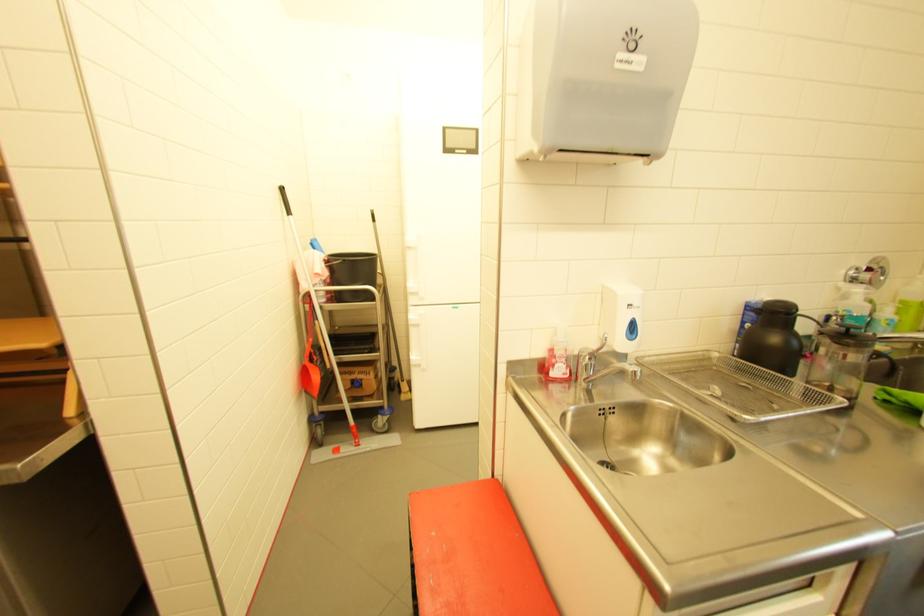
Where is `black thermos`? The height and width of the screenshot is (616, 924). black thermos is located at coordinates (772, 338).